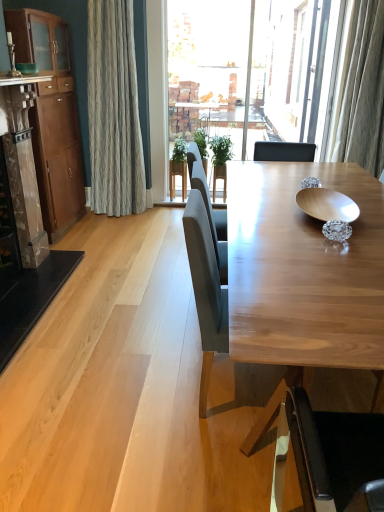
At what (x,y) coordinates should I click in order to perform the action: click on free spot below matte gray chair at center, the 1th chair viewed from the back (from a real-world perspective). Please return your answer as a coordinate pair (x, y). This screenshot has height=512, width=384. Looking at the image, I should click on (232, 397).